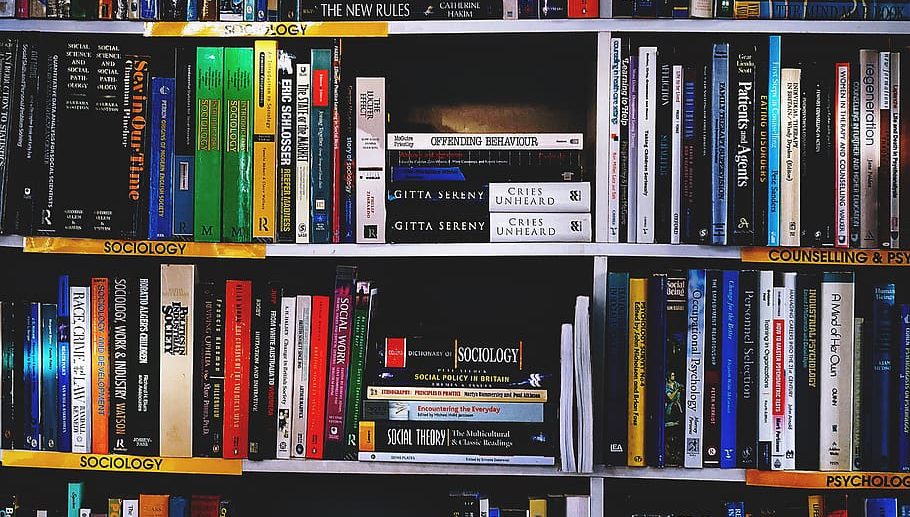
Locate an element on the screen. The width and height of the screenshot is (910, 517). library is located at coordinates (263, 328).